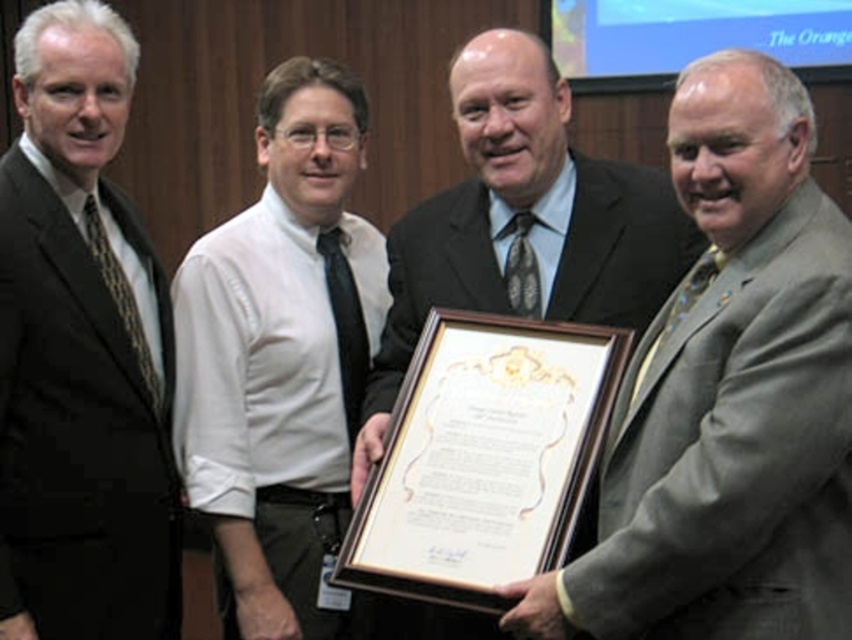
You are a photographer setting up for a group photo. You need to ensure that the white shirt at center and the matte black suit at center are at least 14 inches apart to avoid them blending into each other. Based on the scene description, is the current distance sufficient?

The white shirt at center is 13.27 inches away from the matte black suit at center, which is less than the required 14 inches. Therefore, the current distance is insufficient to prevent them from blending into each other.

You are organizing a charity event and need to arrange seating based on the size of the attendees. The gray wool suit at right and the white shirt at center are two people you need to seat. Which person should be seated in the smaller chair?

The gray wool suit at right should be seated in the smaller chair because the gray wool suit at right has a smaller size compared to the white shirt at center.